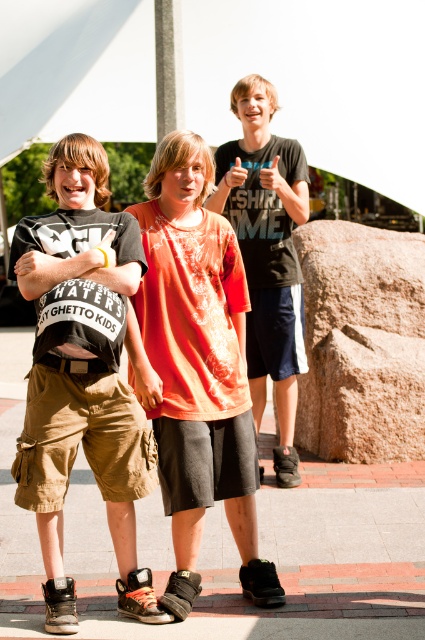
Is tie-dye t-shirt at center shorter than matte black t-shirt at upper center?

Yes, tie-dye t-shirt at center is shorter than matte black t-shirt at upper center.

Image resolution: width=425 pixels, height=640 pixels. Find the location of `tie-dye t-shirt at center`. tie-dye t-shirt at center is located at coordinates (195, 368).

Who is more distant from viewer, (190, 346) or (234, 177)?

Point (234, 177)

The height and width of the screenshot is (640, 425). What are the coordinates of `tie-dye t-shirt at center` in the screenshot? It's located at (195, 368).

I want to click on white fabric canopy at upper center, so click(317, 81).

Can you confirm if white fabric canopy at upper center is positioned below matte black t-shirt at upper center?

Actually, white fabric canopy at upper center is above matte black t-shirt at upper center.

Where is `white fabric canopy at upper center`? white fabric canopy at upper center is located at coordinates (317, 81).

Is matte black t-shirt at left to the right of brown rough rock at right from the viewer's perspective?

No, matte black t-shirt at left is not to the right of brown rough rock at right.

Is matte black t-shirt at left wider than brown rough rock at right?

In fact, matte black t-shirt at left might be narrower than brown rough rock at right.

Is point (34, 468) closer to camera compared to point (362, 410)?

That is True.

Where is `matte black t-shirt at left`? matte black t-shirt at left is located at coordinates (82, 372).